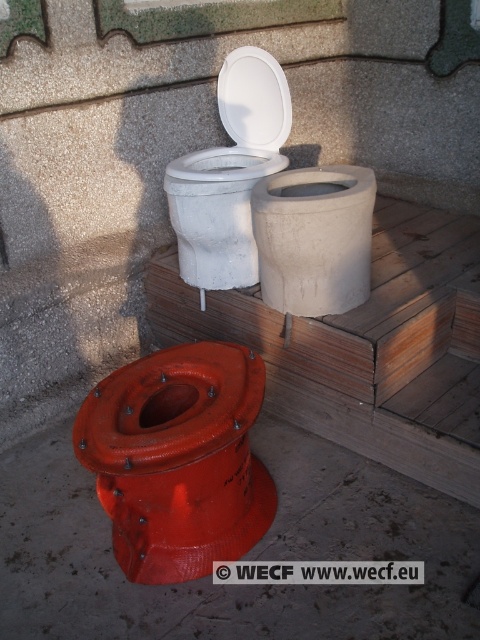
You are standing at the front of the wooden platform where the toilets are displayed. You notice two points marked on the ground at coordinates point (x=261, y=246) and point (x=241, y=230). Which point is closer to you?

Point (x=261, y=246) is in front of point (x=241, y=230), so it is closer to you.

You are a contractor assessing the toilets for installation in a new eco village. You need to choose between the matte concrete toilet bowl at center and the white matte toilet bowl at upper center based on their height. Which toilet is shorter?

The matte concrete toilet bowl at center is not as tall as the white matte toilet bowl at upper center, so the matte concrete toilet bowl at center is shorter.